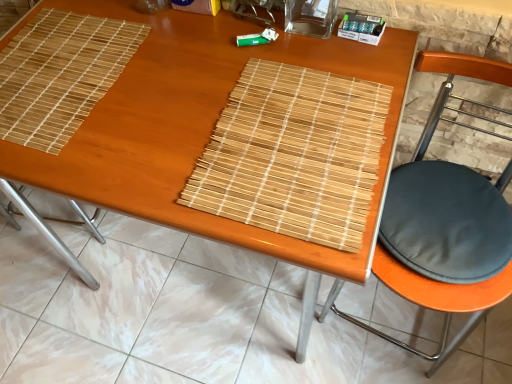
Identify the location of vacant space in front of natural wood mat at upper left, positioned as the second mat in right-to-left order. The height and width of the screenshot is (384, 512). (96, 162).